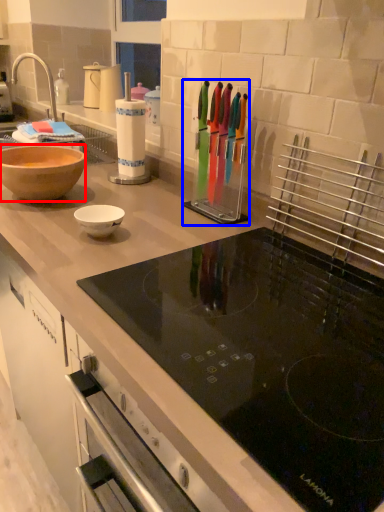
Question: Among these objects, which one is nearest to the camera, bowl (highlighted by a red box) or appliance (highlighted by a blue box)?

Choices:
 (A) bowl
 (B) appliance

Answer: (B)